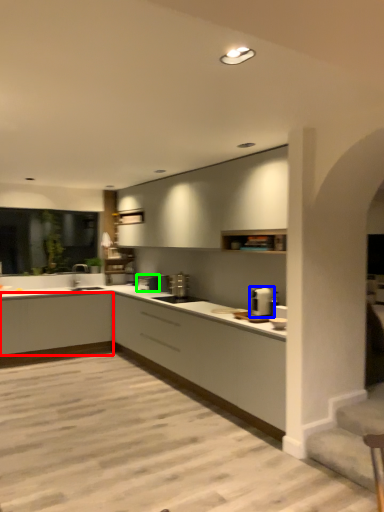
Question: Which is nearer to the cabinetry (highlighted by a red box)? appliance (highlighted by a blue box) or appliance (highlighted by a green box).

Choices:
 (A) appliance
 (B) appliance

Answer: (B)